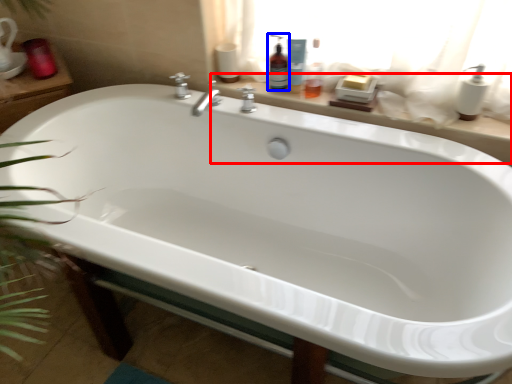
Question: Which object appears farthest to the camera in this image, window sill (highlighted by a red box) or cleaning product (highlighted by a blue box)?

Choices:
 (A) window sill
 (B) cleaning product

Answer: (B)